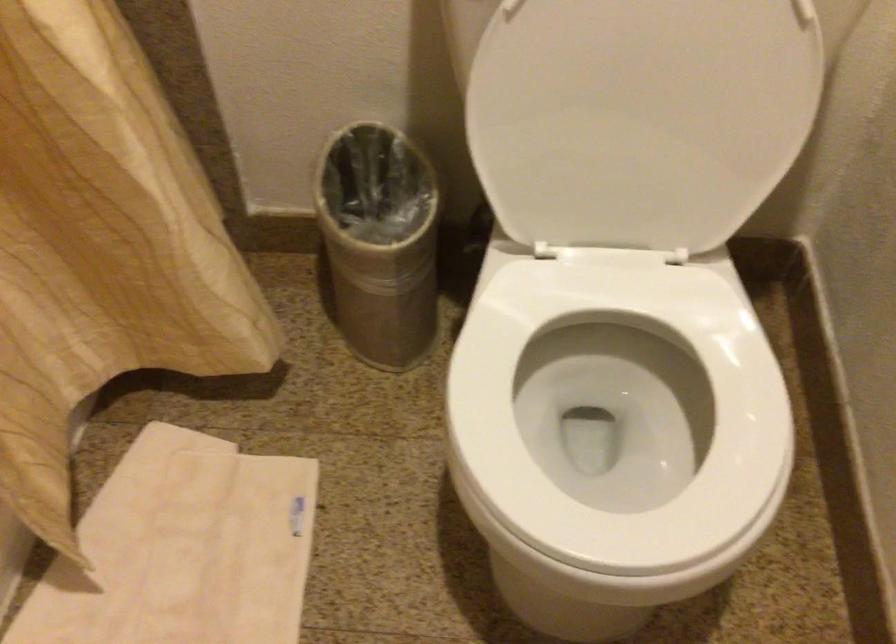
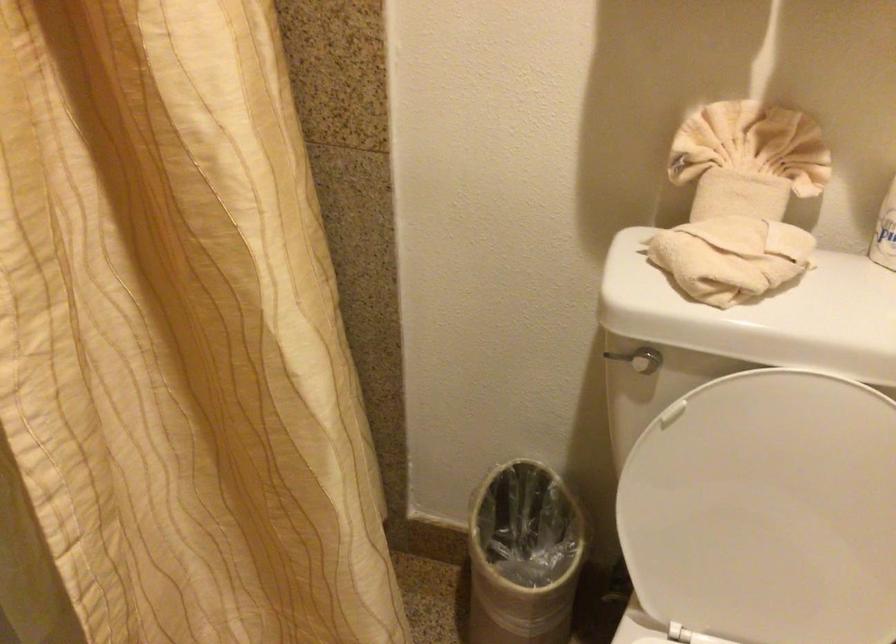
Locate, in the second image, the point that corresponds to pixel 624 98 in the first image.

(767, 511)